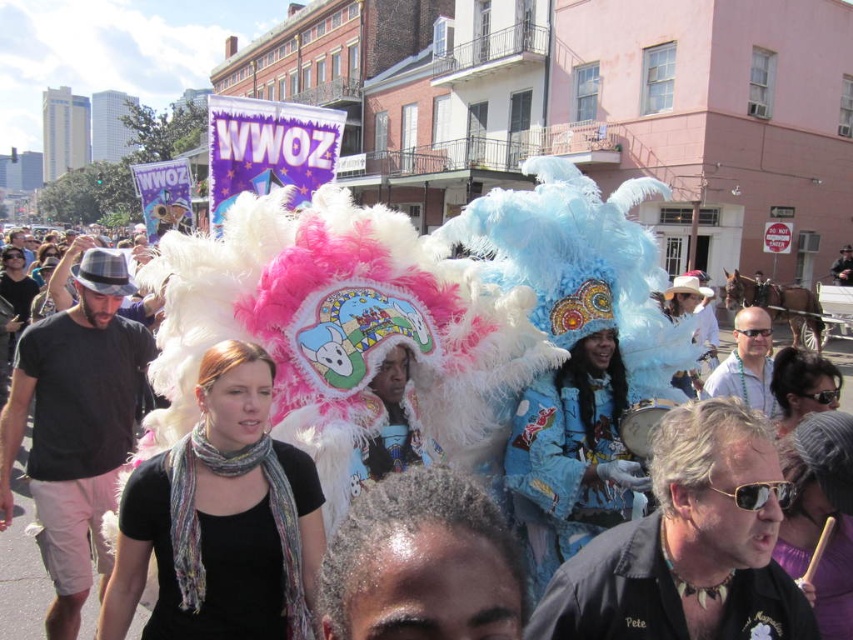
Question: Can you confirm if feathered headdress at center is positioned below multicolored feather headdress at center?

Choices:
 (A) yes
 (B) no

Answer: (B)

Question: Does black scarf at center have a larger size compared to gray hair at center?

Choices:
 (A) no
 (B) yes

Answer: (B)

Question: Which object appears closest to the camera in this image?

Choices:
 (A) black scarf at center
 (B) gray hair at center

Answer: (B)

Question: Which point is closer to the camera?

Choices:
 (A) feathered headdress at center
 (B) black scarf at center
 (C) multicolored feather headdress at center
 (D) gray hair at center

Answer: (D)

Question: Which object is positioned closest to the black scarf at center?

Choices:
 (A) feathered headdress at center
 (B) gray hair at center

Answer: (A)

Question: Does black scarf at center appear under multicolored feather headdress at center?

Choices:
 (A) yes
 (B) no

Answer: (A)